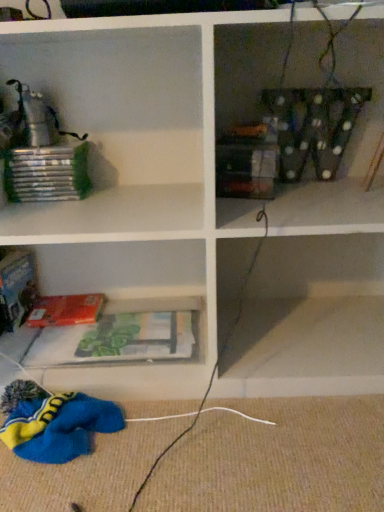
Question: From the image's perspective, is hardcover book at lower left over matte plastic books at lower center?

Choices:
 (A) yes
 (B) no

Answer: (A)

Question: Is hardcover book at lower left positioned in front of matte plastic books at lower center?

Choices:
 (A) yes
 (B) no

Answer: (B)

Question: Could you tell me if hardcover book at lower left is turned towards matte plastic books at lower center?

Choices:
 (A) no
 (B) yes

Answer: (A)

Question: Does hardcover book at lower left have a lesser width compared to matte plastic books at lower center?

Choices:
 (A) yes
 (B) no

Answer: (A)

Question: Is hardcover book at lower left further to the viewer compared to matte plastic books at lower center?

Choices:
 (A) yes
 (B) no

Answer: (A)

Question: Is there a large distance between hardcover book at lower left and matte plastic books at lower center?

Choices:
 (A) no
 (B) yes

Answer: (A)

Question: From the image's perspective, does matte plastic books at lower center appear higher than hardcover book at lower left?

Choices:
 (A) no
 (B) yes

Answer: (A)

Question: Is matte plastic books at lower center not within hardcover book at lower left?

Choices:
 (A) yes
 (B) no

Answer: (A)

Question: From a real-world perspective, is matte plastic books at lower center physically above hardcover book at lower left?

Choices:
 (A) yes
 (B) no

Answer: (A)

Question: From the image's perspective, does matte plastic books at lower center appear lower than hardcover book at lower left?

Choices:
 (A) no
 (B) yes

Answer: (B)

Question: Is matte plastic books at lower center shorter than hardcover book at lower left?

Choices:
 (A) no
 (B) yes

Answer: (A)

Question: Is hardcover book at lower left completely or partially inside matte plastic books at lower center?

Choices:
 (A) no
 (B) yes

Answer: (A)

Question: Is point 64,353 positioned closer to the camera than point 39,324?

Choices:
 (A) closer
 (B) farther

Answer: (A)